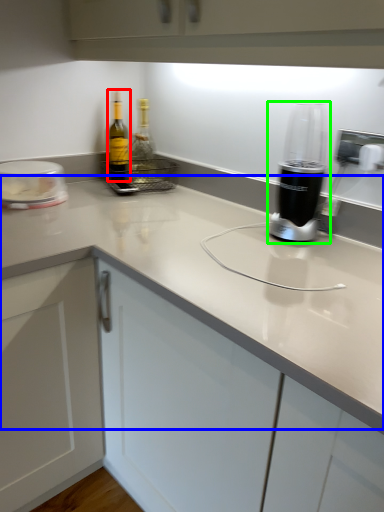
Question: Which object is the farthest from bottle (highlighted by a red box)? Choose among these: counter top (highlighted by a blue box) or home appliance (highlighted by a green box).

Choices:
 (A) counter top
 (B) home appliance

Answer: (B)